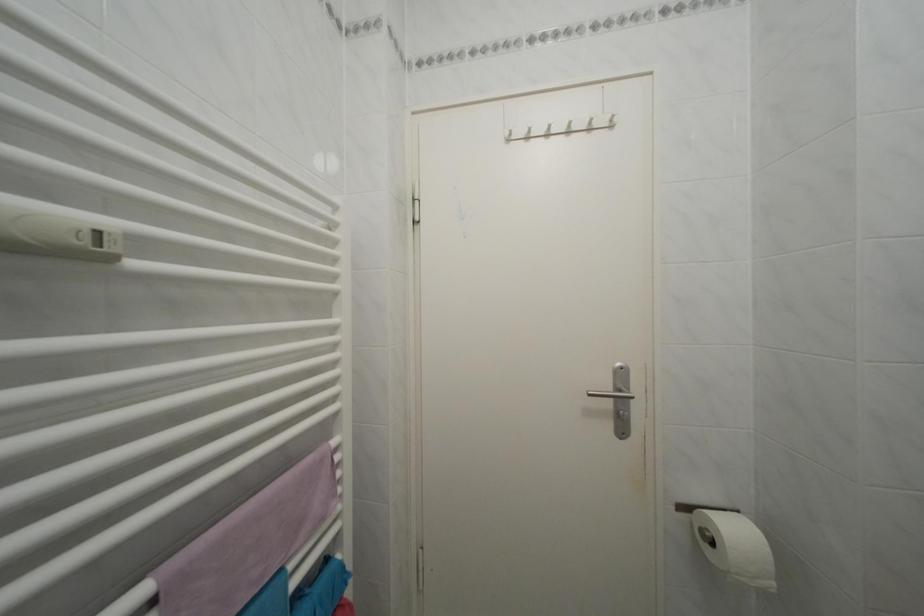
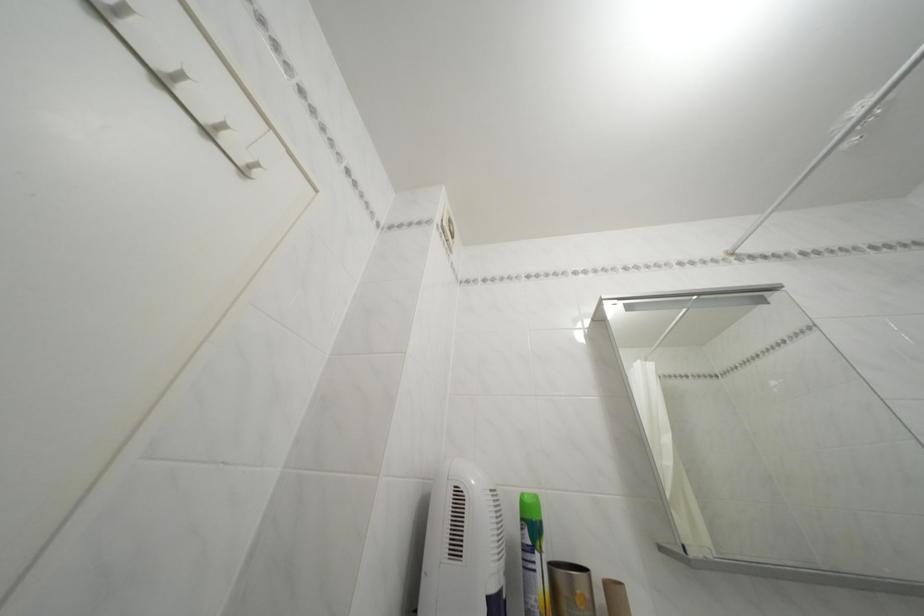
The point at [599,136] is marked in the first image. Where is the corresponding point in the second image?

(216, 139)